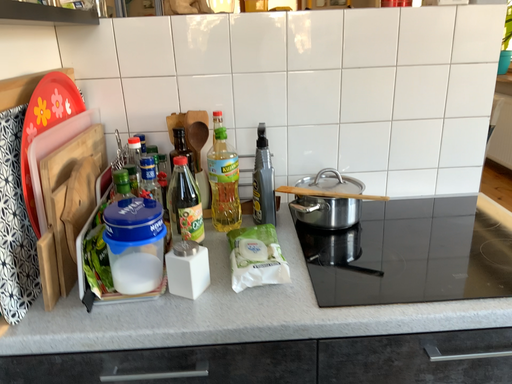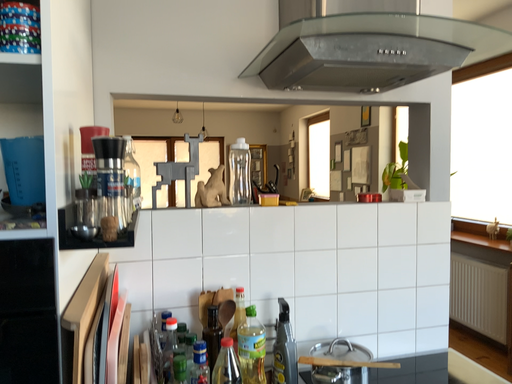
Question: Which way did the camera rotate in the video?

Choices:
 (A) rotated right
 (B) rotated left

Answer: (A)